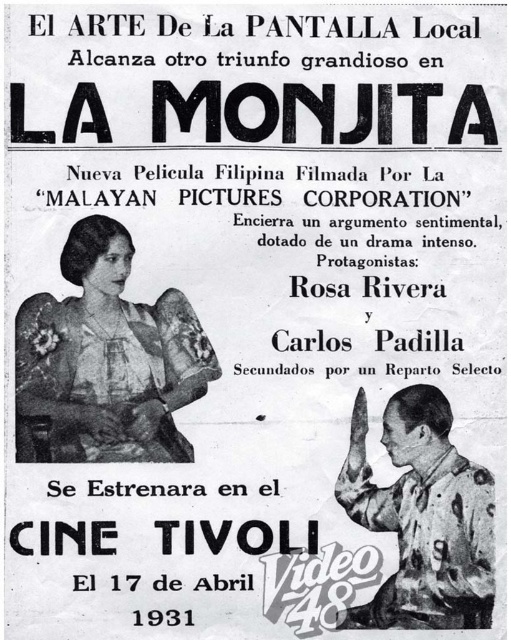
Question: Which point appears farthest from the camera in this image?

Choices:
 (A) (105, 416)
 (B) (431, 509)

Answer: (B)

Question: Which of the following is the closest to the observer?

Choices:
 (A) camouflage fabric uniform at lower right
 (B) matte floral dress at center-left

Answer: (B)

Question: Can you confirm if matte floral dress at center-left is positioned to the right of camouflage fabric uniform at lower right?

Choices:
 (A) yes
 (B) no

Answer: (B)

Question: Is matte floral dress at center-left positioned in front of camouflage fabric uniform at lower right?

Choices:
 (A) yes
 (B) no

Answer: (A)

Question: Is matte floral dress at center-left behind camouflage fabric uniform at lower right?

Choices:
 (A) yes
 (B) no

Answer: (B)